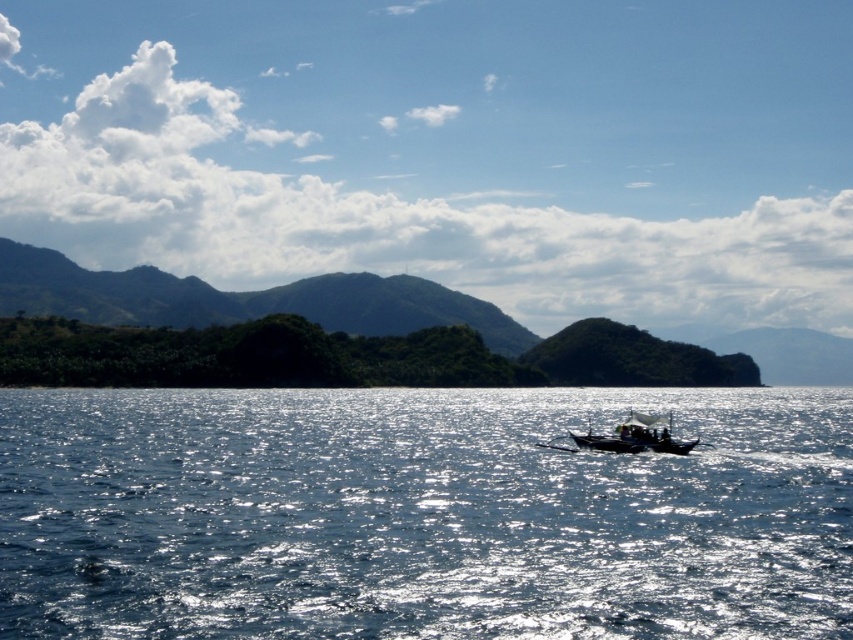
You are a photographer planning to take a landscape photo of the glistening blue water at center and the green leafy mountain at left. Based on their positions, which object should you focus on first if you want to capture both in sharp focus?

The glistening blue water at center is below the green leafy mountain at left, so you should focus on the green leafy mountain at left first to ensure both are in sharp focus since it is closer to the camera.

You are observing a seascape painting and notice two points marked in the image. The first point is at coordinates point [637,628] and the second is at point [668,420]. Based on the perspective in the painting, which point is located closer to the viewer?

Point [637,628] is closer to the viewer than point [668,420].

You are an observer standing on the shore looking out at the seascape. You notice the glistening blue water at center and the black wooden boat at center. Which object occupies more space in your field of view?

The glistening blue water at center occupies more space in your field of view because it is larger in size than the black wooden boat at center.